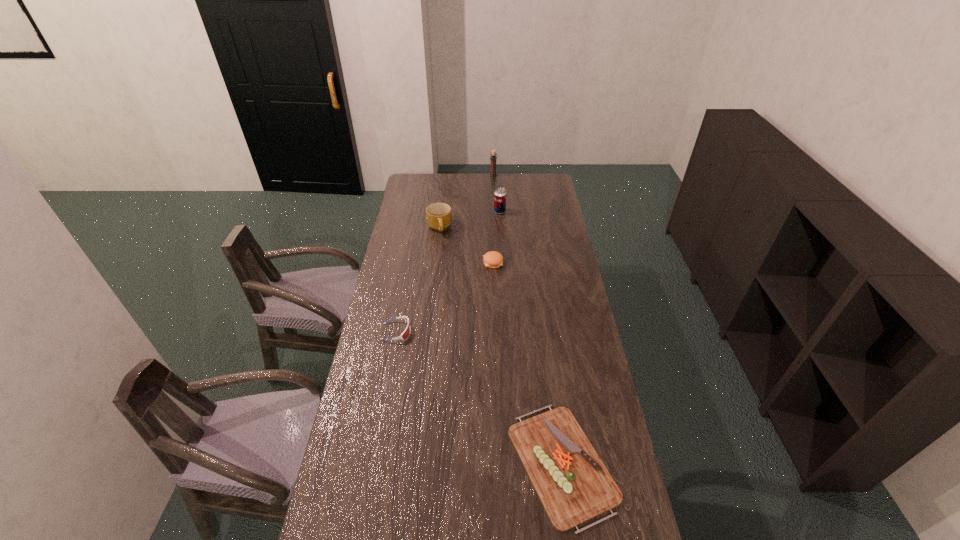
Image resolution: width=960 pixels, height=540 pixels. Identify the location of vacant space located 0.400m on the left of the farthest object. pos(420,176).

You are a GUI agent. You are given a task and a screenshot of the screen. Output one action in this format:
    pyautogui.click(x=<x>, y=<y>)
    Task: Click on the vacant space located on the back of the fifth shortest object
    The width and height of the screenshot is (960, 540).
    Given the screenshot: What is the action you would take?
    pyautogui.click(x=499, y=202)

What are the coordinates of `free spot located 0.060m on the side with the handle of the third tallest object` in the screenshot? It's located at (438, 246).

Find the location of a particular element. vacant space located on the front-facing side of the goggles is located at coordinates (503, 332).

Find the location of a particular element. The image size is (960, 540). vacant space located on the front of the fourth farthest object is located at coordinates (493, 278).

Locate an element on the screen. This screenshot has width=960, height=540. vacant region located 0.250m on the back of the nearest object is located at coordinates (545, 346).

Image resolution: width=960 pixels, height=540 pixels. What are the coordinates of `object at the far edge` in the screenshot? It's located at (493, 157).

At what (x,y) coordinates should I click in order to perform the action: click on mug at the left edge. Please return your answer as a coordinate pair (x, y). Looking at the image, I should click on (438, 215).

The image size is (960, 540). In order to click on goggles at the left edge in this screenshot , I will do `click(405, 334)`.

You are a GUI agent. You are given a task and a screenshot of the screen. Output one action in this format:
    pyautogui.click(x=<x>, y=<y>)
    Task: Click on the object located at the right edge
    The height and width of the screenshot is (540, 960).
    Given the screenshot: What is the action you would take?
    pyautogui.click(x=573, y=484)